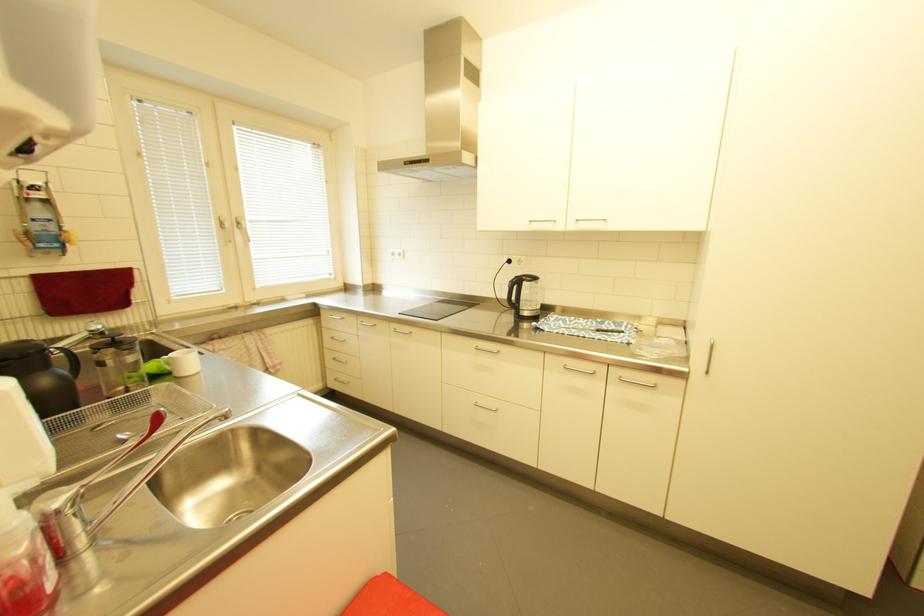
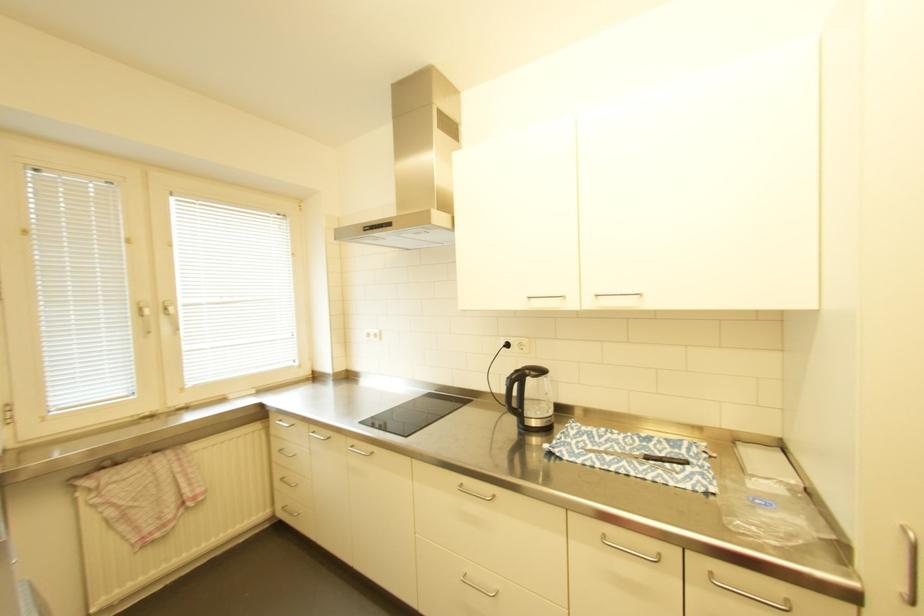
Locate, in the second image, the point that corresponds to (x=517, y=282) in the first image.

(516, 379)